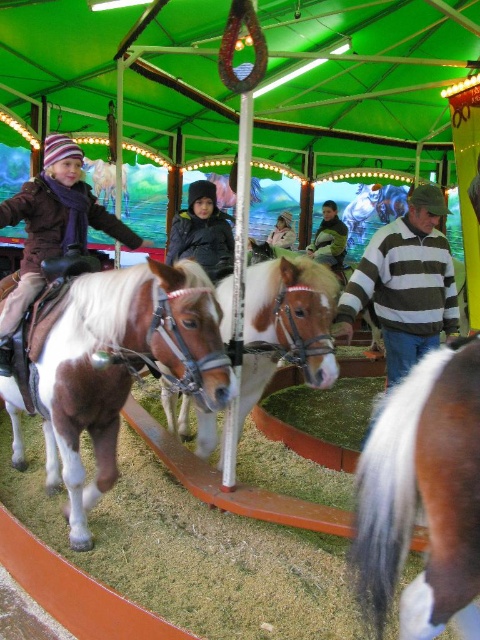
Based on the photo, you are standing at the entrance of the fairground and see the point marked at coordinates (405, 284). What object is located at that point?

The point at coordinates (405, 284) corresponds to the striped sweater at center.

You are at the fairground and see two children wearing the striped sweater at center and the matte brown jacket at left. Which child is positioned to the right of the other?

The striped sweater at center is to the right of the matte brown jacket at left.